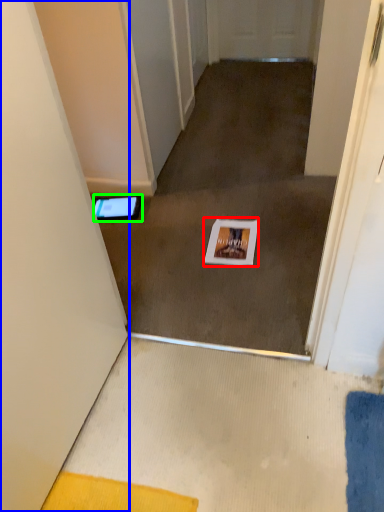
Question: Estimate the real-world distances between objects in this image. Which object is closer to postcard (highlighted by a red box), door (highlighted by a blue box) or tablet computer (highlighted by a green box)?

Choices:
 (A) door
 (B) tablet computer

Answer: (B)